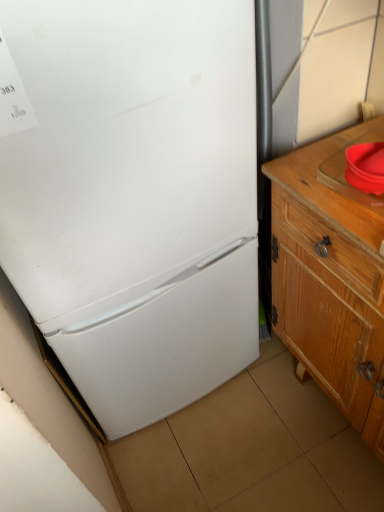
I want to click on free space to the back side of red plastic sink at right, so click(333, 148).